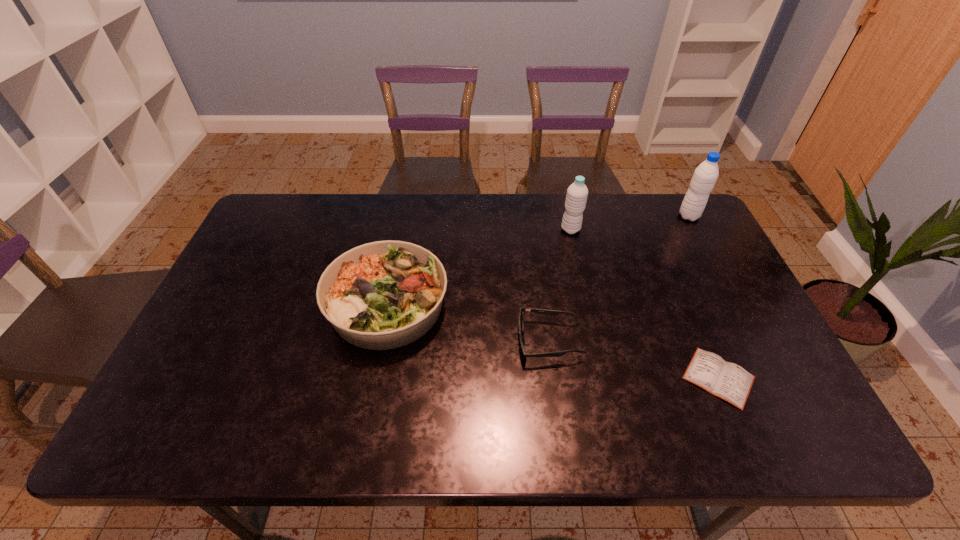
Locate an element on the screen. The height and width of the screenshot is (540, 960). free space between the fourth tallest object and the shortest object is located at coordinates (634, 359).

Where is `free space between the shortest object and the second object from left to right`? free space between the shortest object and the second object from left to right is located at coordinates (634, 359).

Where is `unoccupied position between the third shortest object and the sunglasses`? unoccupied position between the third shortest object and the sunglasses is located at coordinates (468, 323).

What are the coordinates of `free spot between the third tallest object and the second object from right to left` in the screenshot? It's located at click(553, 341).

This screenshot has height=540, width=960. What are the coordinates of `free area in between the rightmost object and the second shortest object` in the screenshot? It's located at (619, 278).

This screenshot has height=540, width=960. Find the location of `vacant space that is in between the farthest object and the second object from left to right`. vacant space that is in between the farthest object and the second object from left to right is located at coordinates (619, 278).

Locate an element on the screen. This screenshot has height=540, width=960. unoccupied area between the second farthest object and the third tallest object is located at coordinates (479, 267).

Image resolution: width=960 pixels, height=540 pixels. Find the location of `object that stands as the fourth closest to the sunglasses`. object that stands as the fourth closest to the sunglasses is located at coordinates (705, 176).

Find the location of a particular element. The image size is (960, 540). object that can be found as the closest to the third shortest object is located at coordinates (542, 311).

Identify the location of vacant area in the image that satisfies the following two spatial constraints: 1. on the back side of the shortest object; 2. on the front-facing side of the second object from left to right. The image size is (960, 540). (703, 341).